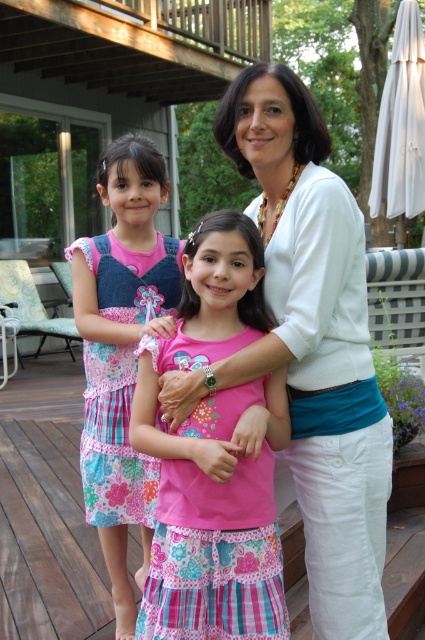
Question: Which object is the closest to the pink fabric dress at center?

Choices:
 (A) floral cotton dress at center
 (B) pink cotton dress at center

Answer: (B)

Question: Which object is closer to the camera taking this photo?

Choices:
 (A) pink fabric dress at center
 (B) pink cotton dress at center
 (C) floral cotton dress at center
 (D) wooden deck at center

Answer: (A)

Question: Which point is farther to the camera?

Choices:
 (A) floral cotton dress at center
 (B) pink fabric dress at center
 (C) pink cotton dress at center

Answer: (A)

Question: Does wooden deck at center have a smaller size compared to floral cotton dress at center?

Choices:
 (A) yes
 (B) no

Answer: (B)

Question: Is pink fabric dress at center below floral cotton dress at center?

Choices:
 (A) yes
 (B) no

Answer: (A)

Question: Is wooden deck at center behind floral cotton dress at center?

Choices:
 (A) yes
 (B) no

Answer: (A)